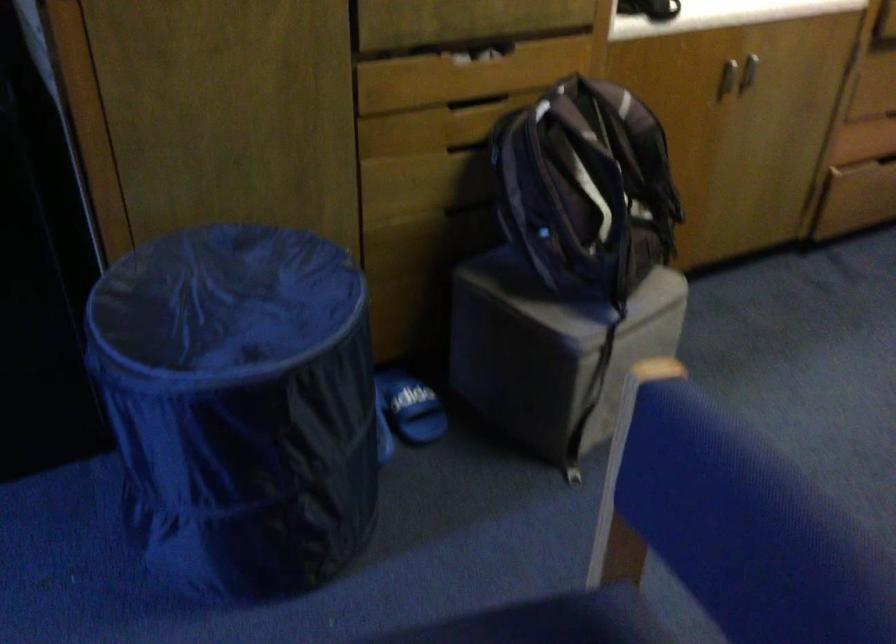
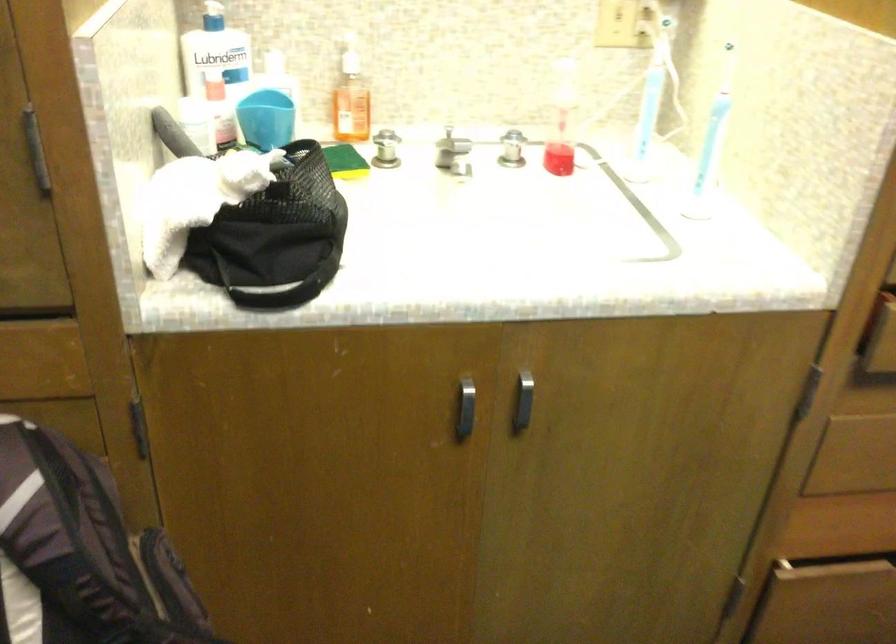
The images are taken continuously from a first-person perspective. In which direction are you moving?

The cameraman walked toward right, forward.